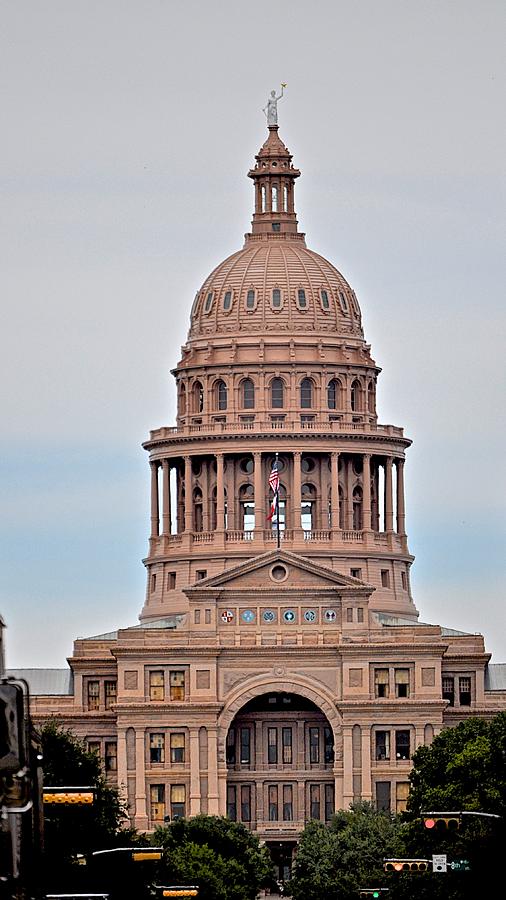
The width and height of the screenshot is (506, 900). I want to click on green light, so click(x=375, y=896).